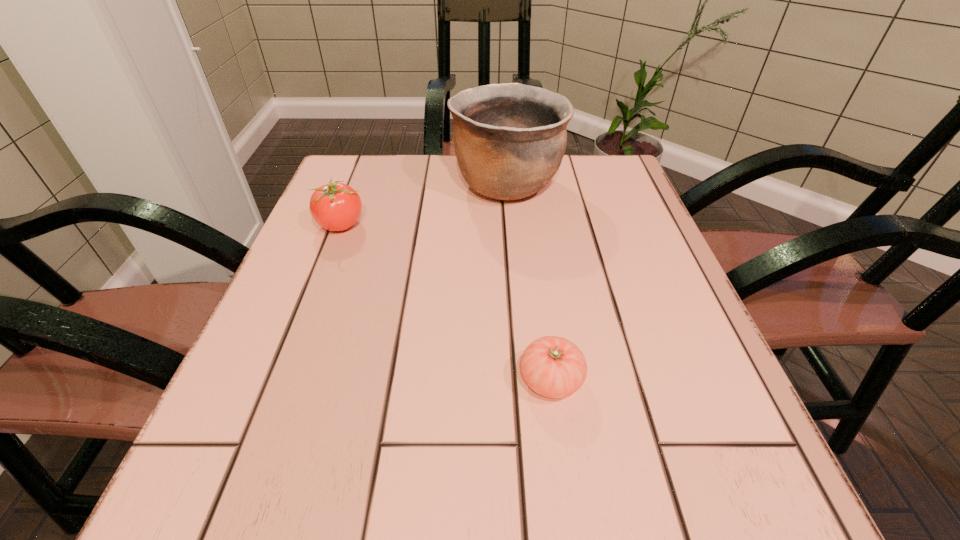
The height and width of the screenshot is (540, 960). Find the location of `pottery`. pottery is located at coordinates (509, 139).

Locate an element on the screen. This screenshot has height=540, width=960. the left tomato is located at coordinates (335, 206).

Where is `the farther tomato`? The height and width of the screenshot is (540, 960). the farther tomato is located at coordinates (x=335, y=206).

Identify the location of the right tomato. This screenshot has height=540, width=960. (554, 367).

Find the location of a particular element. Image resolution: width=960 pixels, height=540 pixels. the shorter tomato is located at coordinates (554, 367).

Identify the location of blank space located on the left of the tallest object. The height and width of the screenshot is (540, 960). (363, 184).

You are a GUI agent. You are given a task and a screenshot of the screen. Output one action in this format:
    pyautogui.click(x=<x>, y=<y>)
    Task: Click on the free space located on the front of the left tomato
    The height and width of the screenshot is (540, 960).
    Given the screenshot: What is the action you would take?
    pyautogui.click(x=275, y=396)

Image resolution: width=960 pixels, height=540 pixels. What are the coordinates of `vacant space located 0.130m on the front of the nearer tomato` in the screenshot? It's located at [568, 507].

Locate an element on the screen. object present at the far edge is located at coordinates (509, 139).

The image size is (960, 540). I want to click on object present at the left edge, so click(x=335, y=206).